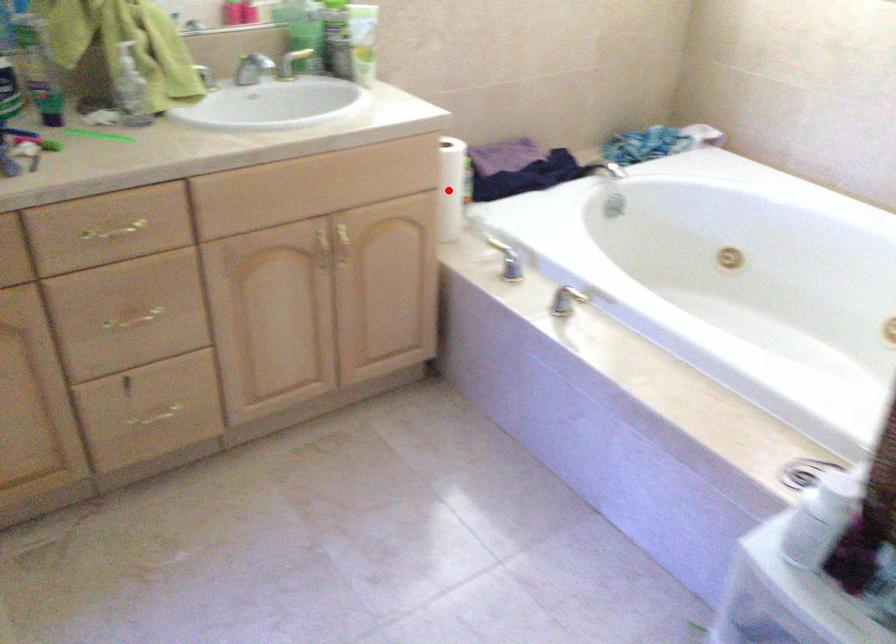
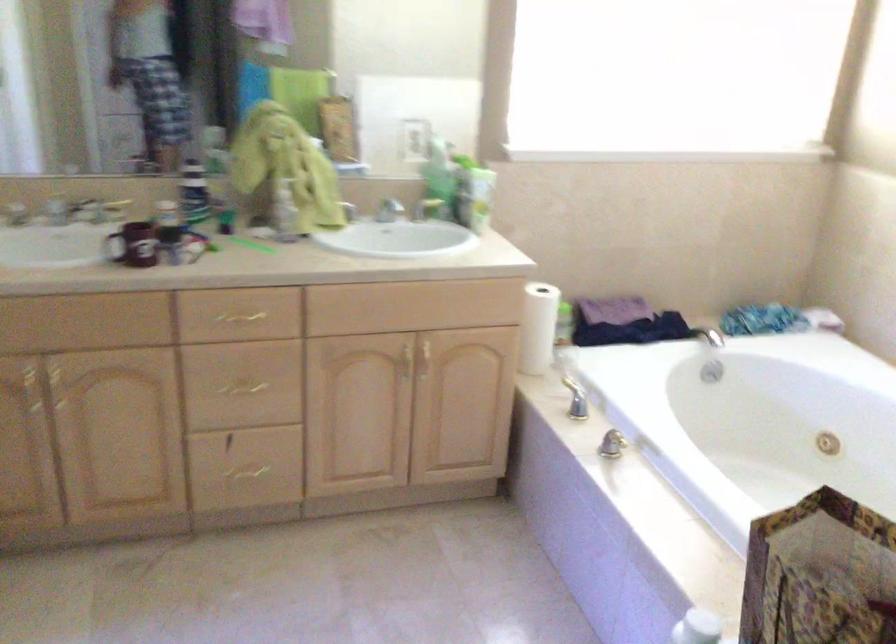
Question: I am providing you with two images of the same scene from different viewpoints. Given a red point in image1, look at the same physical point in image2. Is it:

Choices:
 (A) Closer to the viewpoint
 (B) Farther from the viewpoint

Answer: (B)